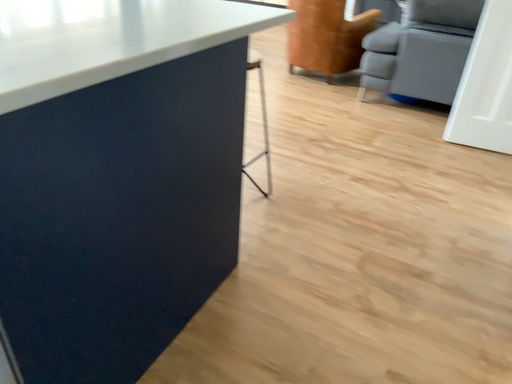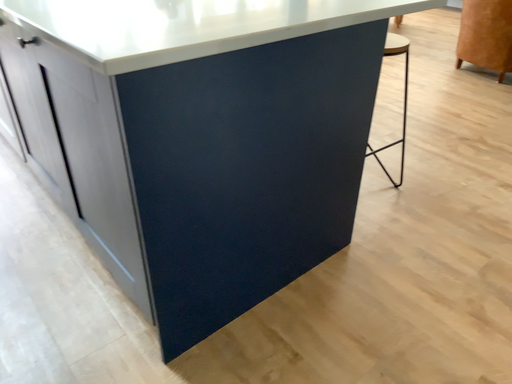
Question: Which way did the camera rotate in the video?

Choices:
 (A) rotated right
 (B) rotated left

Answer: (B)